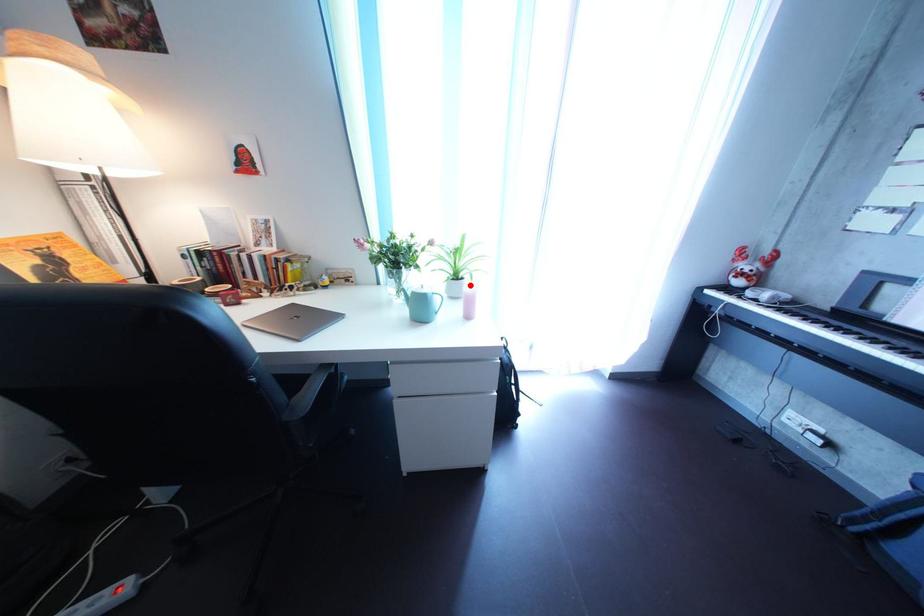
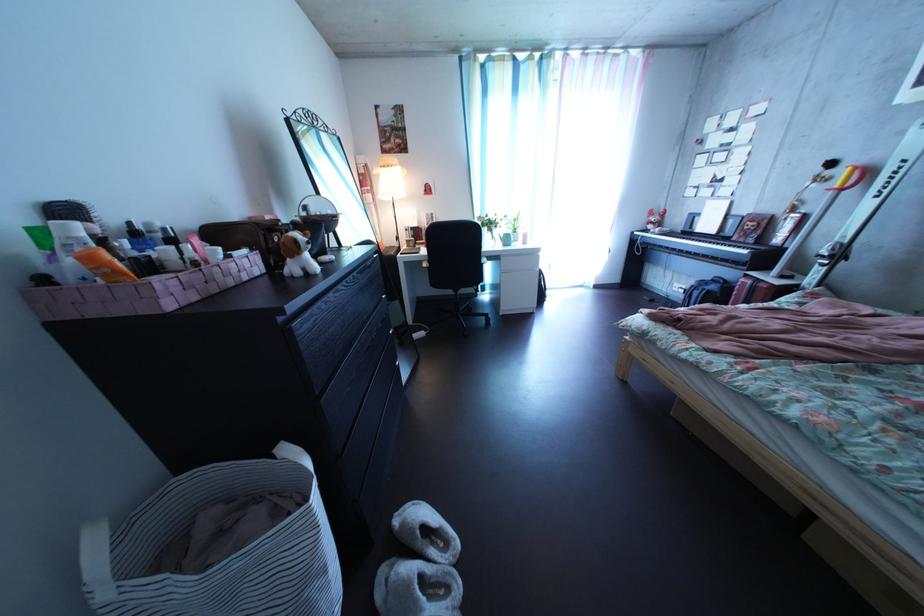
Question: A red point is marked in image1. In image2, is the corresponding 3D point closer to the camera or farther? Reply with the corresponding letter.

Choices:
 (A) The corresponding 3D point is closer.
 (B) The corresponding 3D point is farther.

Answer: (A)